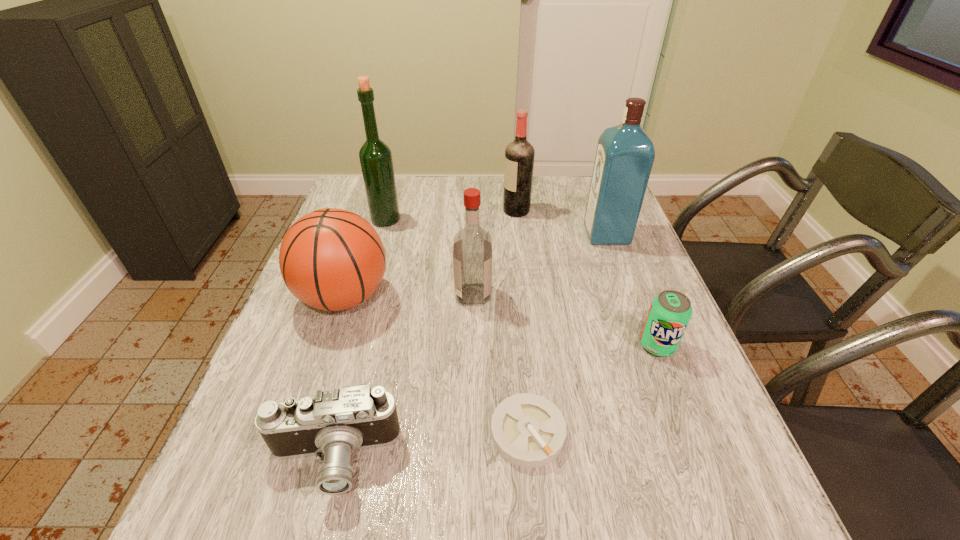
Image resolution: width=960 pixels, height=540 pixels. What are the coordinates of `vacant region between the camera and the nearest liquor` in the screenshot? It's located at (403, 377).

Find the location of a particular element. free point between the shortest object and the pop soda is located at coordinates (592, 389).

Where is `object that can be found as the seventh closest to the nearest liquor`? This screenshot has height=540, width=960. object that can be found as the seventh closest to the nearest liquor is located at coordinates (670, 312).

Locate an element on the screen. This screenshot has width=960, height=540. object that is the fourth closest to the shortest object is located at coordinates (331, 259).

Locate an element on the screen. The image size is (960, 540). liquor object that ranks as the third closest to the rightmost liquor is located at coordinates (375, 156).

Identify which liquor is located as the second nearest to the leftmost liquor. Please provide its 2D coordinates. Your answer should be formatted as a tuple, i.e. [(x, y)], where the tuple contains the x and y coordinates of a point satisfying the conditions above.

[(519, 155)]

Image resolution: width=960 pixels, height=540 pixels. Identify the location of vacant region that satisfies the following two spatial constraints: 1. on the flat label side of the rightmost liquor; 2. at the lens of the camera. (689, 459).

You are a GUI agent. You are given a task and a screenshot of the screen. Output one action in this format:
    pyautogui.click(x=<x>, y=<y>)
    Task: Click on the vacant region that satisfies the following two spatial constraints: 1. on the front-facing side of the nearest liquor; 2. at the lens of the camera
    This screenshot has width=960, height=540.
    Given the screenshot: What is the action you would take?
    point(470,459)